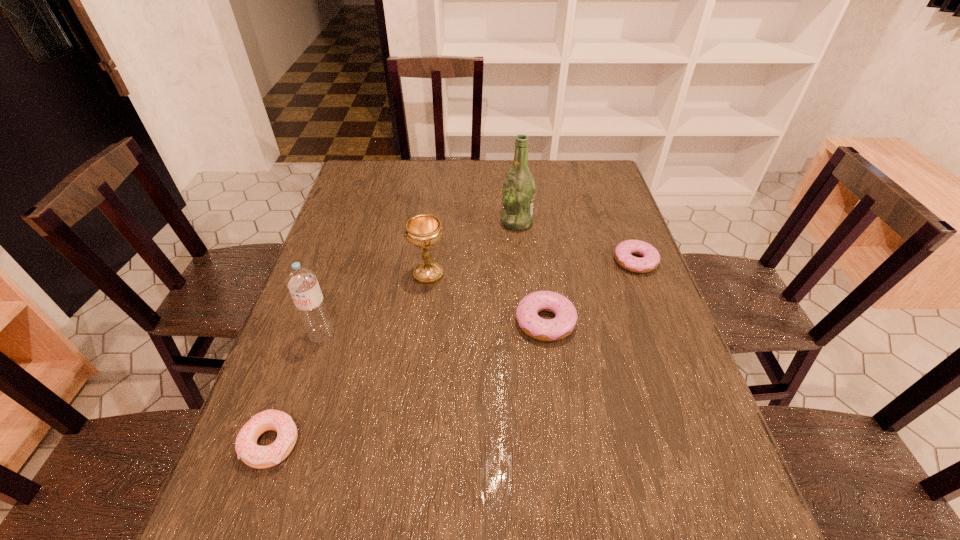
The width and height of the screenshot is (960, 540). Identify the location of free area in between the tallest object and the second doughnut from right to left. (531, 272).

The image size is (960, 540). What are the coordinates of `free point between the second tallest object and the second nearest doughnut` in the screenshot? It's located at (434, 328).

Where is `vacant space that's between the chalice and the beer bottle`? The height and width of the screenshot is (540, 960). vacant space that's between the chalice and the beer bottle is located at coordinates (472, 248).

Where is `free space between the third object from left to right and the leftmost doughnut`? This screenshot has height=540, width=960. free space between the third object from left to right and the leftmost doughnut is located at coordinates (349, 359).

I want to click on vacant space that's between the chalice and the water bottle, so click(375, 305).

At what (x,y) coordinates should I click in order to perform the action: click on unoccupied area between the second tallest object and the nearest object. Please return your answer as a coordinate pair (x, y). The image size is (960, 540). Looking at the image, I should click on (297, 389).

Identify which object is the fifth closest to the fourth object from right to left. Please provide its 2D coordinates. Your answer should be formatted as a tuple, i.e. [(x, y)], where the tuple contains the x and y coordinates of a point satisfying the conditions above.

[(650, 260)]

Find the location of a particular element. The height and width of the screenshot is (540, 960). the third closest object to the farthest object is located at coordinates (547, 330).

In order to click on doughnut that stands as the closest to the second doughnut from left to right in this screenshot , I will do `click(650, 260)`.

Identify which doughnut is the second closest to the rightmost object. Please provide its 2D coordinates. Your answer should be formatted as a tuple, i.e. [(x, y)], where the tuple contains the x and y coordinates of a point satisfying the conditions above.

[(256, 456)]